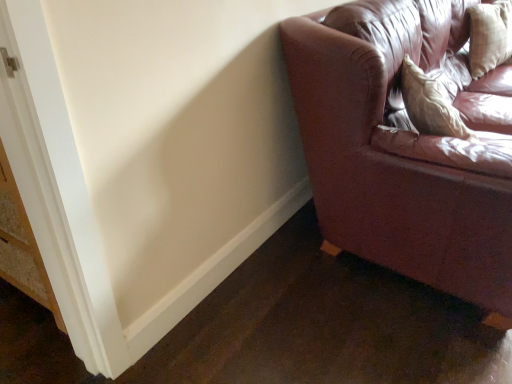
Where is `beige cotton pillow at upper right`? beige cotton pillow at upper right is located at coordinates (x=489, y=36).

Measure the distance between beige cotton pillow at upper right and camera.

beige cotton pillow at upper right and camera are 2.34 meters apart.

What is the approximate width of beige cotton pillow at upper right?

The width of beige cotton pillow at upper right is 8.07 inches.

Describe the element at coordinates (489, 36) in the screenshot. The image size is (512, 384). I see `beige cotton pillow at upper right` at that location.

Identify the location of beige cotton pillow at upper right. (489, 36).